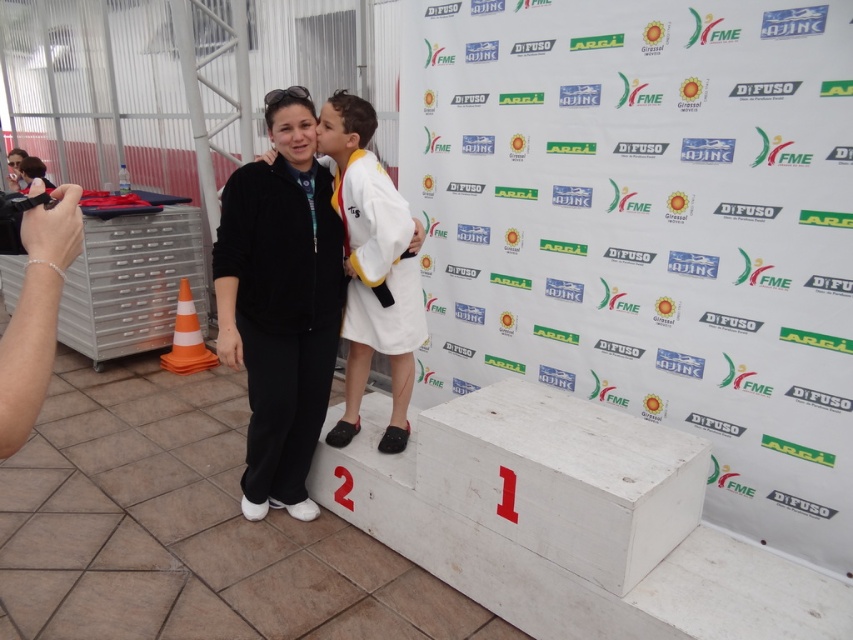
Is point (299, 381) closer to camera compared to point (422, 232)?

No, (299, 381) is further to viewer.

Consider the image. How much distance is there between black matte jacket at center and white cotton kimono at center?

The distance of black matte jacket at center from white cotton kimono at center is 9.25 inches.

Who is more forward, [286,211] or [352,404]?

Point [286,211]

Identify the location of black matte jacket at center. The width and height of the screenshot is (853, 640). (280, 301).